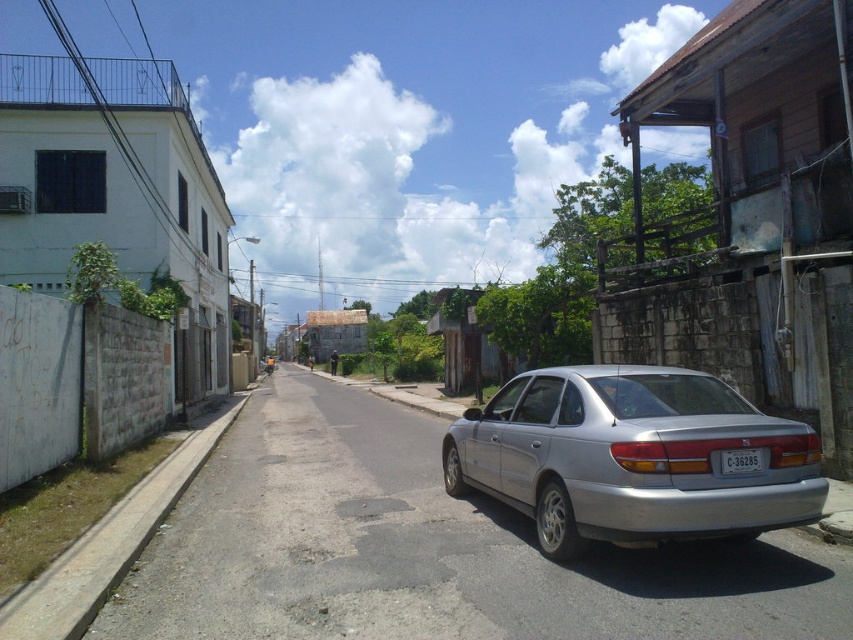
Question: Observing the image, what is the correct spatial positioning of silver metallic car at center in reference to white plastic license plate at rear?

Choices:
 (A) left
 (B) right

Answer: (A)

Question: Which is nearer to the white plastic license plate at rear?

Choices:
 (A) silver metallic car at right
 (B) silver metallic car at center

Answer: (A)

Question: In this image, where is silver metallic car at center located relative to white plastic license plate at rear?

Choices:
 (A) above
 (B) below

Answer: (B)

Question: Estimate the real-world distances between objects in this image. Which object is farther from the white plastic license plate at rear?

Choices:
 (A) silver metallic car at center
 (B) silver metallic car at right

Answer: (A)

Question: Where is silver metallic car at right located in relation to white plastic license plate at rear in the image?

Choices:
 (A) right
 (B) left

Answer: (B)

Question: Which object is positioned farthest from the white plastic license plate at rear?

Choices:
 (A) silver metallic car at right
 (B) silver metallic car at center

Answer: (B)